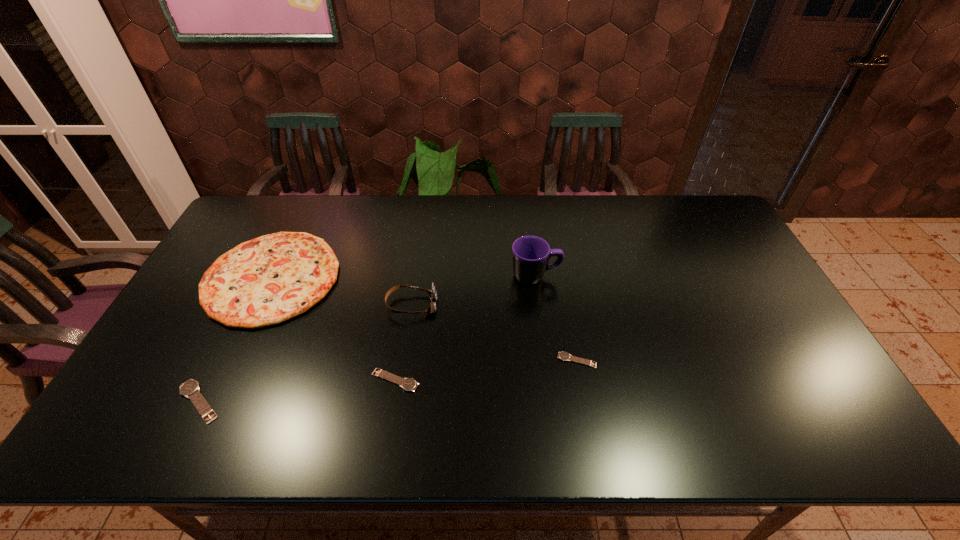
The image size is (960, 540). What are the coordinates of `blank region between the goggles and the third shortest object` in the screenshot? It's located at (305, 353).

Locate an element on the screen. empty space that is in between the fifth tallest object and the shortest object is located at coordinates (486, 370).

Locate an element on the screen. The height and width of the screenshot is (540, 960). vacant space that is in between the second shortest watch and the shortest object is located at coordinates (486, 370).

I want to click on free space that is in between the tallest object and the rightmost watch, so click(556, 318).

I want to click on free spot between the fourth shortest object and the mug, so click(x=403, y=277).

Choose which object is the nearest neighbor to the shortest watch. Please provide its 2D coordinates. Your answer should be formatted as a tuple, i.e. [(x, y)], where the tuple contains the x and y coordinates of a point satisfying the conditions above.

[(530, 254)]

Identify which object is located as the second nearest to the second tallest watch. Please provide its 2D coordinates. Your answer should be formatted as a tuple, i.e. [(x, y)], where the tuple contains the x and y coordinates of a point satisfying the conditions above.

[(265, 281)]

Identify the location of watch that is the closest to the tallest object. (564, 356).

Select which watch is the third closest to the pizza. Please provide its 2D coordinates. Your answer should be formatted as a tuple, i.e. [(x, y)], where the tuple contains the x and y coordinates of a point satisfying the conditions above.

[(564, 356)]

You are a GUI agent. You are given a task and a screenshot of the screen. Output one action in this format:
    pyautogui.click(x=<x>, y=<y>)
    Task: Click on the vacant space that satisfies the following two spatial constraints: 1. on the back side of the second shortest object; 2. on the right side of the leftmost watch
    
    Given the screenshot: What is the action you would take?
    pyautogui.click(x=209, y=380)